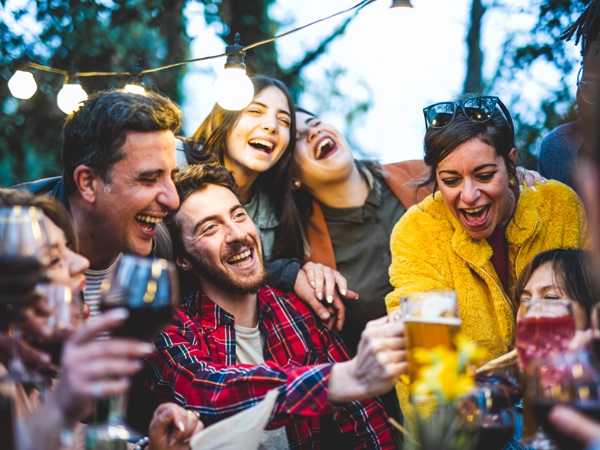
Where is `lightbulbs`? The height and width of the screenshot is (450, 600). lightbulbs is located at coordinates (18, 81), (52, 100), (129, 89), (237, 99).